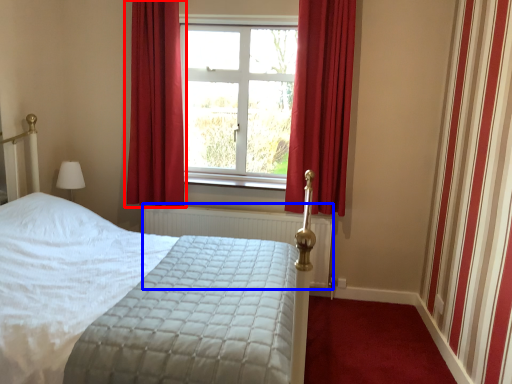
Question: Which point is further to the camera, curtain (highlighted by a red box) or radiator (highlighted by a blue box)?

Choices:
 (A) curtain
 (B) radiator

Answer: (B)